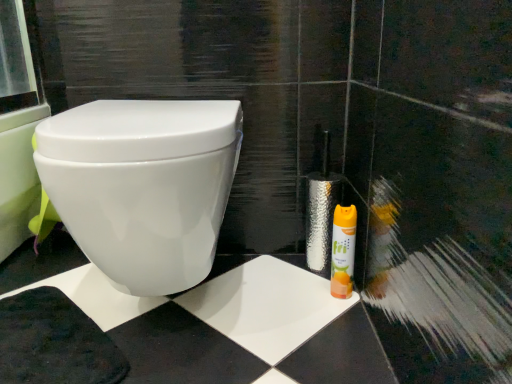
Question: Should I look upward or downward to see yellow matte canister at lower right?

Choices:
 (A) up
 (B) down

Answer: (B)

Question: Is white glossy toilet at center not inside yellow matte canister at lower right?

Choices:
 (A) no
 (B) yes

Answer: (B)

Question: Is white glossy toilet at center closer to the viewer compared to yellow matte canister at lower right?

Choices:
 (A) yes
 (B) no

Answer: (A)

Question: Is white glossy toilet at center taller than yellow matte canister at lower right?

Choices:
 (A) no
 (B) yes

Answer: (B)

Question: Is white glossy toilet at center to the left of yellow matte canister at lower right from the viewer's perspective?

Choices:
 (A) yes
 (B) no

Answer: (A)

Question: Is white glossy toilet at center behind yellow matte canister at lower right?

Choices:
 (A) yes
 (B) no

Answer: (B)

Question: Considering the relative sizes of white glossy toilet at center and yellow matte canister at lower right in the image provided, is white glossy toilet at center wider than yellow matte canister at lower right?

Choices:
 (A) no
 (B) yes

Answer: (B)

Question: Are yellow matte canister at lower right and white glossy toilet at center making contact?

Choices:
 (A) no
 (B) yes

Answer: (A)

Question: Is the position of yellow matte canister at lower right more distant than that of white glossy toilet at center?

Choices:
 (A) no
 (B) yes

Answer: (B)

Question: Is yellow matte canister at lower right looking in the opposite direction of white glossy toilet at center?

Choices:
 (A) yes
 (B) no

Answer: (B)

Question: Considering the relative sizes of yellow matte canister at lower right and white glossy toilet at center in the image provided, is yellow matte canister at lower right wider than white glossy toilet at center?

Choices:
 (A) yes
 (B) no

Answer: (B)

Question: From a real-world perspective, is yellow matte canister at lower right physically above white glossy toilet at center?

Choices:
 (A) no
 (B) yes

Answer: (A)

Question: Does yellow matte canister at lower right come in front of white glossy toilet at center?

Choices:
 (A) no
 (B) yes

Answer: (A)

Question: Considering the positions of white glossy toilet at center and yellow matte canister at lower right in the image, is white glossy toilet at center wider or thinner than yellow matte canister at lower right?

Choices:
 (A) wide
 (B) thin

Answer: (A)